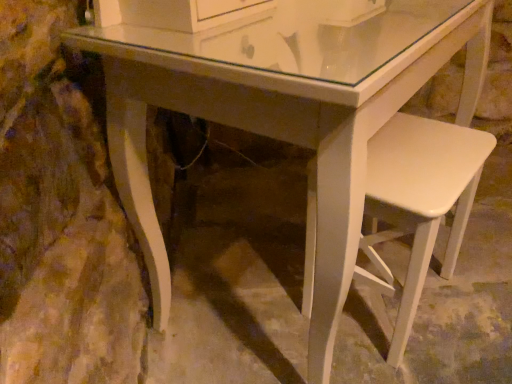
At what (x,y) coordinates should I click in order to perform the action: click on vacant position to the left of white matte wood bar stool at lower right. Please return your answer as a coordinate pair (x, y). The width and height of the screenshot is (512, 384). Looking at the image, I should click on (258, 309).